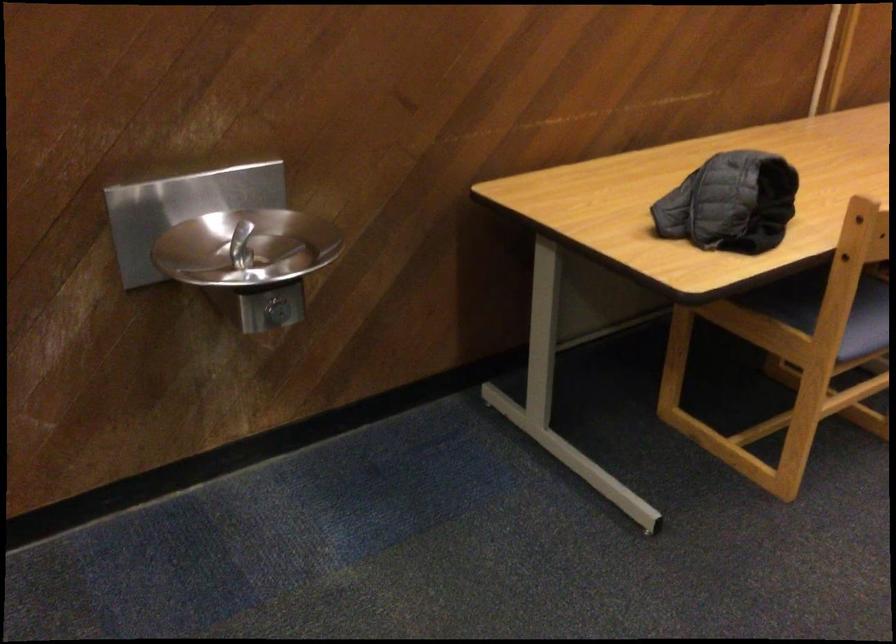
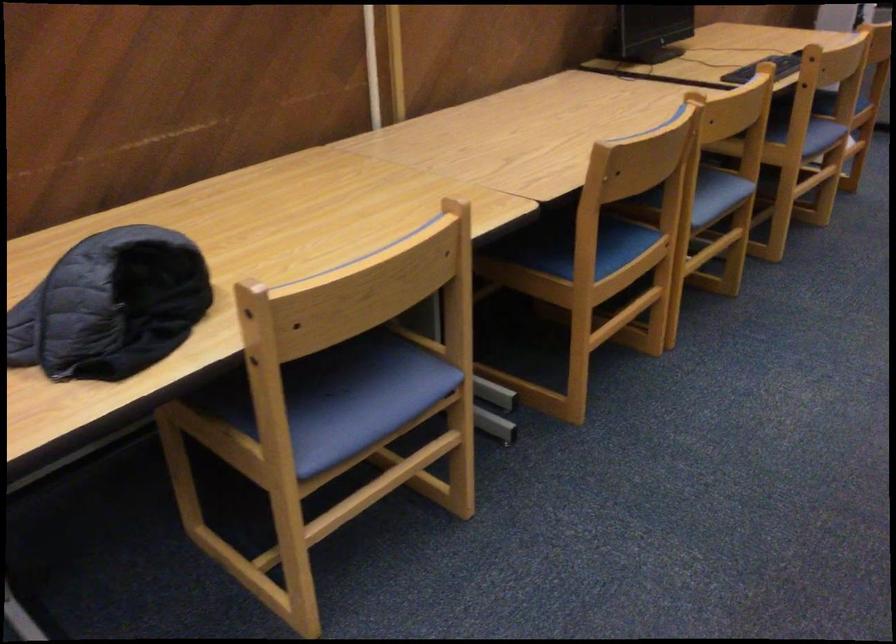
Question: The first image is from the beginning of the video and the second image is from the end. How did the camera likely rotate when shooting the video?

Choices:
 (A) Left
 (B) Right
 (C) Up
 (D) Down

Answer: (B)